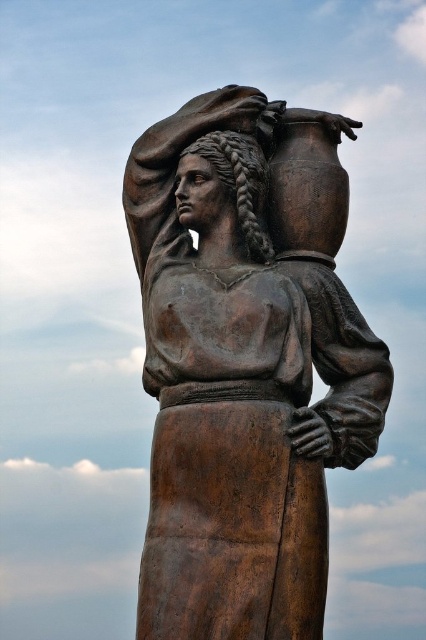
You are an art student analyzing the composition of the statue. Where is the bronze head at center positioned in terms of coordinates?

The bronze head at center is positioned at coordinates point (238, 180).